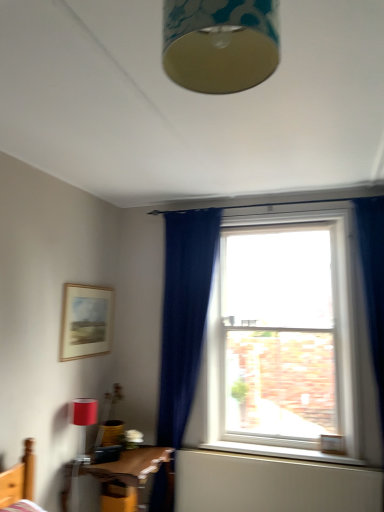
Question: Is wooden table at lower left bigger than matte red lampshade at lower left?

Choices:
 (A) no
 (B) yes

Answer: (B)

Question: From the image's perspective, is wooden table at lower left located beneath matte red lampshade at lower left?

Choices:
 (A) no
 (B) yes

Answer: (B)

Question: Can you confirm if wooden table at lower left is thinner than matte red lampshade at lower left?

Choices:
 (A) yes
 (B) no

Answer: (B)

Question: Does wooden table at lower left appear on the right side of matte red lampshade at lower left?

Choices:
 (A) no
 (B) yes

Answer: (B)

Question: Can you confirm if wooden table at lower left is smaller than matte red lampshade at lower left?

Choices:
 (A) no
 (B) yes

Answer: (A)

Question: Is wooden table at lower left to the left of matte red lampshade at lower left from the viewer's perspective?

Choices:
 (A) yes
 (B) no

Answer: (B)

Question: Can you see matte red lampshade at lower left touching white wooden window sill at lower center?

Choices:
 (A) yes
 (B) no

Answer: (B)

Question: Is matte red lampshade at lower left thinner than white wooden window sill at lower center?

Choices:
 (A) yes
 (B) no

Answer: (A)

Question: Is matte red lampshade at lower left behind white wooden window sill at lower center?

Choices:
 (A) yes
 (B) no

Answer: (B)

Question: Is matte red lampshade at lower left positioned with its back to white wooden window sill at lower center?

Choices:
 (A) yes
 (B) no

Answer: (B)

Question: Is matte red lampshade at lower left bigger than white wooden window sill at lower center?

Choices:
 (A) no
 (B) yes

Answer: (B)

Question: Considering the relative sizes of matte red lampshade at lower left and white wooden window sill at lower center in the image provided, is matte red lampshade at lower left wider than white wooden window sill at lower center?

Choices:
 (A) yes
 (B) no

Answer: (B)

Question: Is matte gold lampshade at upper center further to camera compared to matte wooden picture frame at upper left?

Choices:
 (A) yes
 (B) no

Answer: (B)